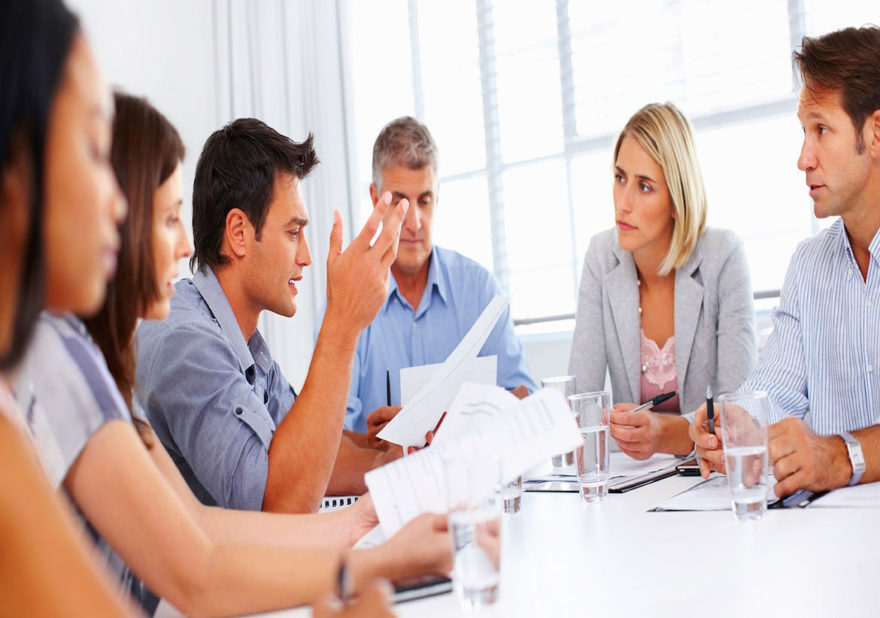
Where is `papers`? papers is located at coordinates (412, 378), (460, 371), (473, 396), (532, 442).